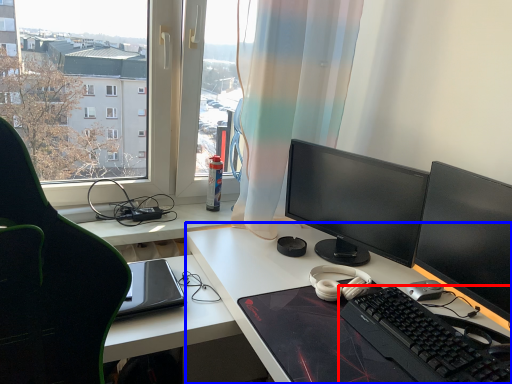
Question: Among these objects, which one is nearest to the camera, computer keyboard (highlighted by a red box) or desk (highlighted by a blue box)?

Choices:
 (A) computer keyboard
 (B) desk

Answer: (B)